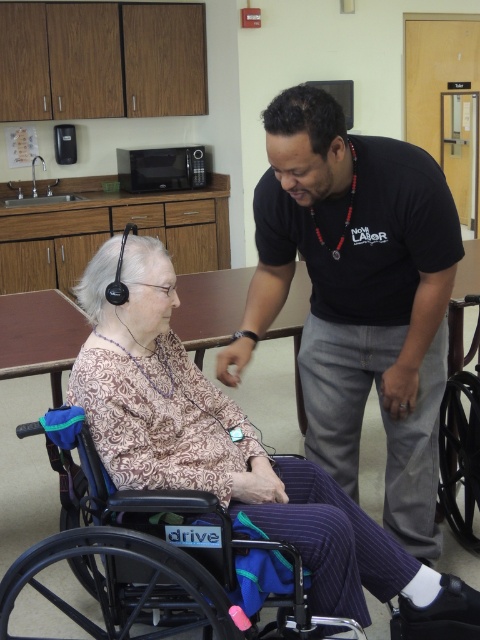
Question: Is black plastic wheelchair at lower left wider than black plastic wheelchair at lower right?

Choices:
 (A) yes
 (B) no

Answer: (A)

Question: Which object appears closest to the camera in this image?

Choices:
 (A) black cotton shirt at center
 (B) black plastic wheelchair at lower right
 (C) black plastic wheelchair at lower left

Answer: (C)

Question: Can you confirm if black cotton shirt at center is positioned below black plastic wheelchair at lower right?

Choices:
 (A) no
 (B) yes

Answer: (A)

Question: Among these points, which one is farthest from the camera?

Choices:
 (A) (271, 138)
 (B) (128, 557)
 (C) (444, 426)
 (D) (122, 401)

Answer: (C)

Question: Estimate the real-world distances between objects in this image. Which object is closer to the black cotton shirt at center?

Choices:
 (A) patterned fabric dress at lower left
 (B) black plastic wheelchair at lower left

Answer: (A)

Question: Does patterned fabric dress at lower left appear on the right side of black plastic wheelchair at lower left?

Choices:
 (A) yes
 (B) no

Answer: (A)